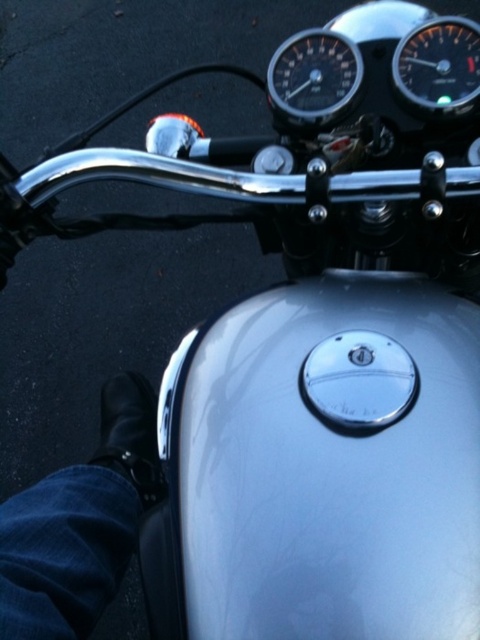
Between black leather shoe at lower left and shiny black speedometer at upper center, which one is positioned lower?

black leather shoe at lower left

Is the position of black leather shoe at lower left more distant than that of shiny black speedometer at upper center?

No, it is in front of shiny black speedometer at upper center.

Is point (148, 387) positioned in front of point (316, 100)?

That is False.

Where is `black leather shoe at lower left`? The image size is (480, 640). black leather shoe at lower left is located at coordinates (80, 524).

Which is in front, point (291, 74) or point (459, 36)?

Point (459, 36) is more forward.

Does point (314, 36) come behind point (423, 77)?

Yes.

Where is `shiny black speedometer at upper center`? The image size is (480, 640). shiny black speedometer at upper center is located at coordinates (313, 80).

Does black leather shoe at lower left have a greater width compared to black glossy speedometer at upper right?

Yes, black leather shoe at lower left is wider than black glossy speedometer at upper right.

Is black leather shoe at lower left below black glossy speedometer at upper right?

Indeed, black leather shoe at lower left is positioned under black glossy speedometer at upper right.

Is point (27, 625) positioned in front of point (418, 28)?

That is True.

Where is `black leather shoe at lower left`? black leather shoe at lower left is located at coordinates (80, 524).